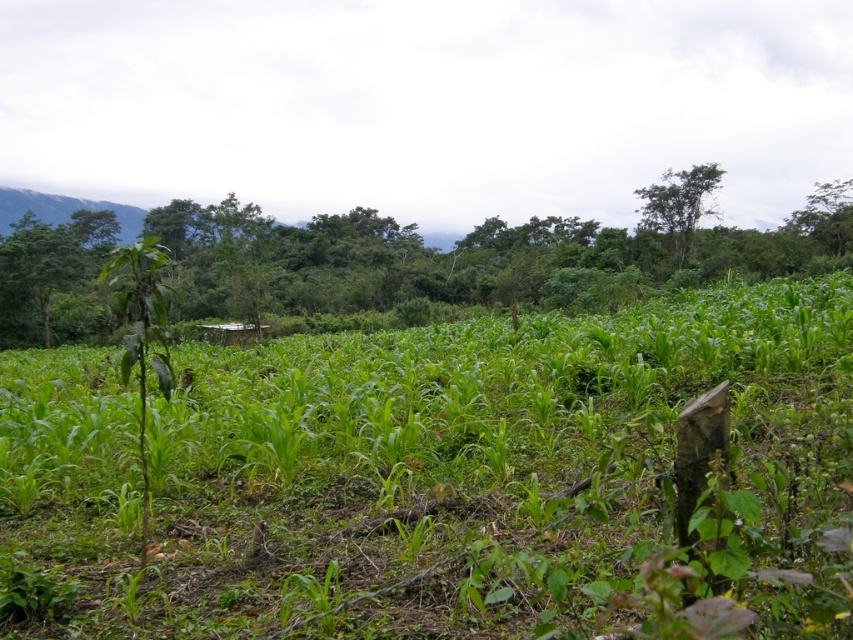
Question: Which object appears farthest from the camera in this image?

Choices:
 (A) green leafy corn at center
 (B) green leafy tree at center
 (C) green leafy tree at upper right

Answer: (C)

Question: Is green leafy tree at center positioned before green leafy tree at upper right?

Choices:
 (A) yes
 (B) no

Answer: (A)

Question: Is green leafy corn at center above green leafy tree at center?

Choices:
 (A) no
 (B) yes

Answer: (A)

Question: Which point is closer to the camera taking this photo?

Choices:
 (A) (709, 205)
 (B) (643, 612)
 (C) (369, 305)

Answer: (B)

Question: Which point appears farthest from the camera in this image?

Choices:
 (A) (671, 237)
 (B) (590, 337)

Answer: (A)

Question: Can you confirm if green leafy tree at center is smaller than green leafy tree at upper right?

Choices:
 (A) yes
 (B) no

Answer: (B)